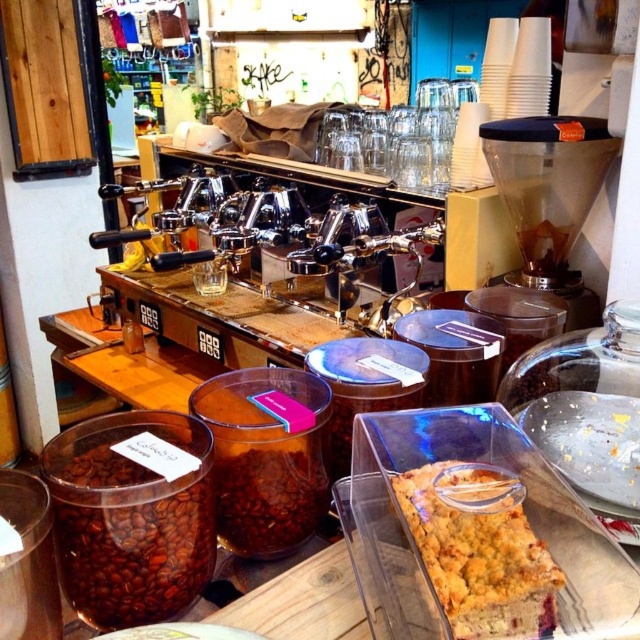
You are a customer at the coffee shop and want to grab both the dark brown matte coffee beans at lower left and the yellow crumbly cake at lower right. Since you can only reach items within your arm span, which item should you pick up first based on their vertical positions?

The dark brown matte coffee beans at lower left should be picked up first because they are located above the yellow crumbly cake at lower right, making them easier to reach from an upright position.

You are standing in the coffee shop and want to take a photo of both the espresso machine and the dessert container. The espresso machine is near the point at (410, 481), and the dessert container is near the point at (164, 516). Since you want both in focus, which point should you focus on to ensure both are clear?

You should focus on point (410, 481) because it is farther from the camera than point (164, 516). Focusing on the farther object will help keep both in focus.

You are a customer at the coffee shop and want to grab both the dark brown matte coffee beans at lower left and the yellow crumbly cake at lower right. Since you can only reach one item at a time, which one should you reach for first to avoid knocking over the other?

You should reach for the dark brown matte coffee beans at lower left first because it is to the left of the yellow crumbly cake at lower right, so grabbing it first would prevent accidentally knocking over the cake on the right.